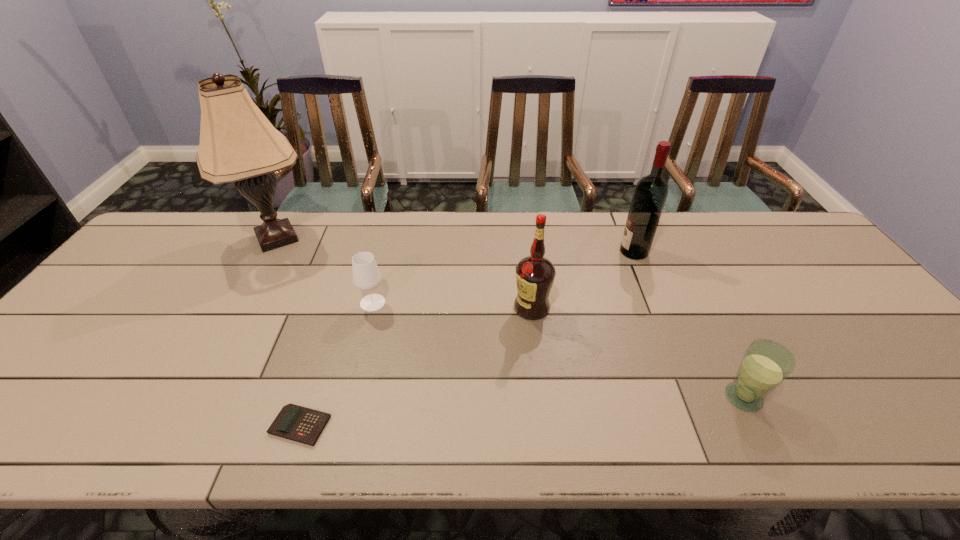
Where is `empty space that is in between the lamp and the rightmost object`? The height and width of the screenshot is (540, 960). empty space that is in between the lamp and the rightmost object is located at coordinates (510, 318).

Locate an element on the screen. This screenshot has width=960, height=540. free space between the nearer alcohol and the shortest object is located at coordinates (416, 367).

This screenshot has width=960, height=540. What are the coordinates of `free space between the fourth object from left to right and the shortest object` in the screenshot? It's located at point(416,367).

Locate an element on the screen. This screenshot has height=540, width=960. empty space between the rightmost object and the farther alcohol is located at coordinates (688, 325).

Locate an element on the screen. The height and width of the screenshot is (540, 960). free space between the shortest object and the farther glass is located at coordinates (336, 364).

The image size is (960, 540). I want to click on free point between the calculator and the shorter alcohol, so click(416, 367).

What are the coordinates of `free point between the right glass and the third object from right to left` in the screenshot? It's located at (637, 353).

This screenshot has width=960, height=540. In order to click on empty space between the farther glass and the leftmost object in this screenshot , I will do `click(324, 271)`.

Locate an element on the screen. The image size is (960, 540). free space between the left glass and the taller alcohol is located at coordinates (503, 277).

Where is `object that stands as the closest to the second tallest object`? Image resolution: width=960 pixels, height=540 pixels. object that stands as the closest to the second tallest object is located at coordinates (535, 274).